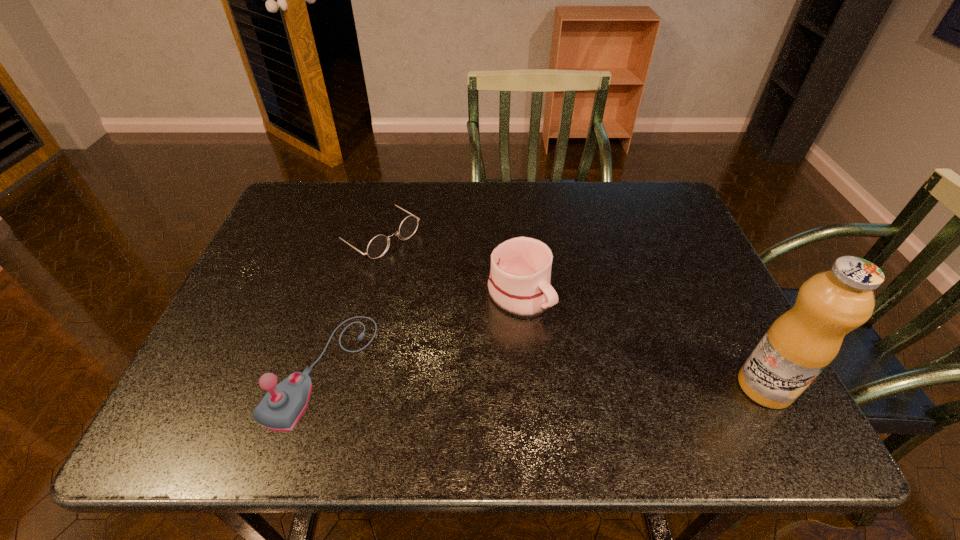
Find the location of a particular element. free location that satisfies the following two spatial constraints: 1. on the front side of the rightmost object; 2. on the front label of the joystick is located at coordinates (317, 387).

Identify the location of vacant region that satisfies the following two spatial constraints: 1. on the back side of the third object from left to right; 2. on the right side of the joystick. The image size is (960, 540). (345, 294).